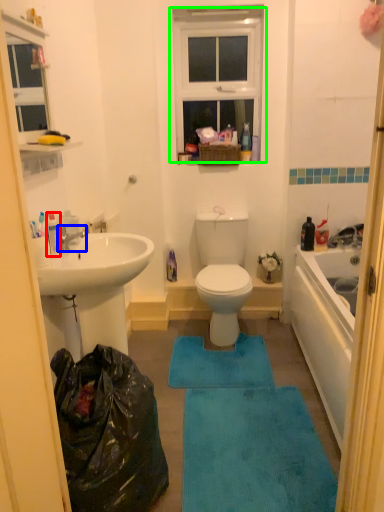
Question: Which object is positioned farthest from toiletry (highlighted by a red box)? Select from tap (highlighted by a blue box) and window (highlighted by a green box).

Choices:
 (A) tap
 (B) window

Answer: (B)